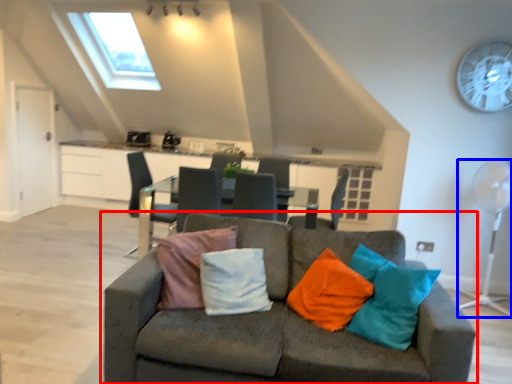
Question: Among these objects, which one is farthest to the camera, studio couch (highlighted by a red box) or mechanical fan (highlighted by a blue box)?

Choices:
 (A) studio couch
 (B) mechanical fan

Answer: (B)